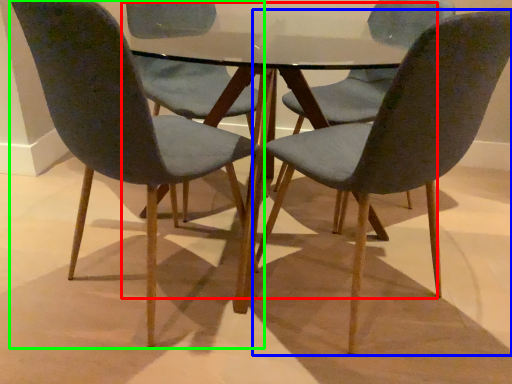
Question: Which object is positioned closest to round table (highlighted by a red box)? Select from chair (highlighted by a blue box) and chair (highlighted by a green box).

Choices:
 (A) chair
 (B) chair

Answer: (A)